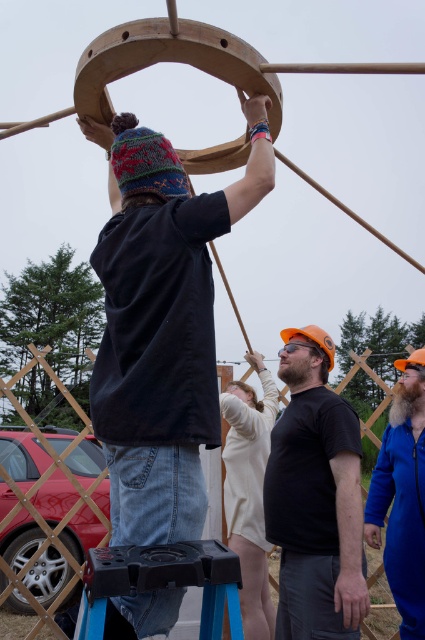
You are a safety inspector checking the construction site. You notice the black matte helmet at center and the black plastic stool at lower center. Which object is closer to you as you stand at the entrance of the site?

The black matte helmet at center is closer to you because it is further to the viewer than the black plastic stool at lower center.

You are a safety inspector checking the construction site depicted in the image. You notice a point marked at coordinates (316, 497). What object is located at this point?

The point at coordinates (316, 497) corresponds to the black matte helmet at center.